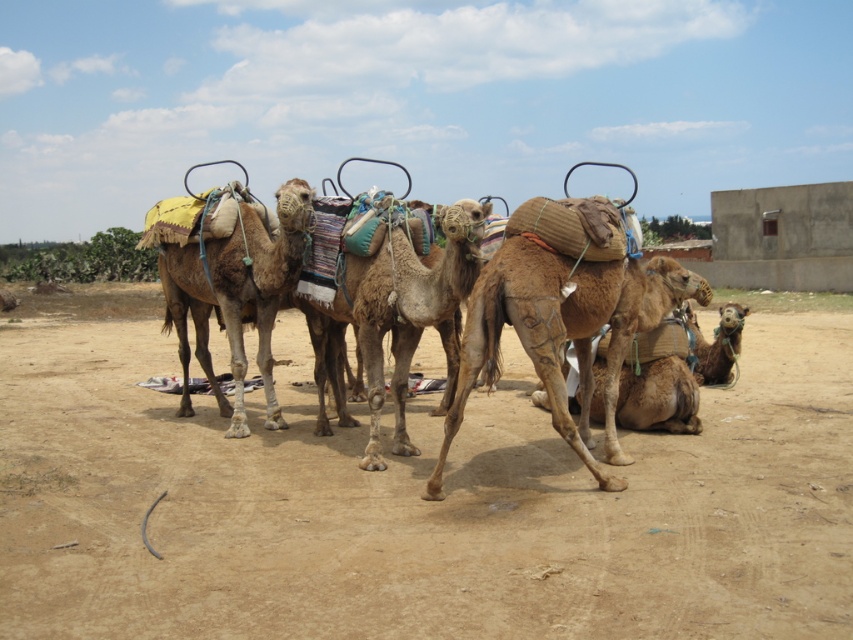
You are a traveler trying to follow a path in the desert. You see a brown sandy dirt track at center and a brown textured camel at center. Which one is closer to you?

The brown sandy dirt track at center is in front of the brown textured camel at center, so the brown sandy dirt track at center is closer to you.

You are a traveler in the desert and need to locate two specific points marked on your map. The first point is at coordinate point[828,358] and the second is at point[648,296]. According to the scene description, which point is closer to the front of the image?

Point[648,296] is closer to the front of the image because it is in front of point[828,358].